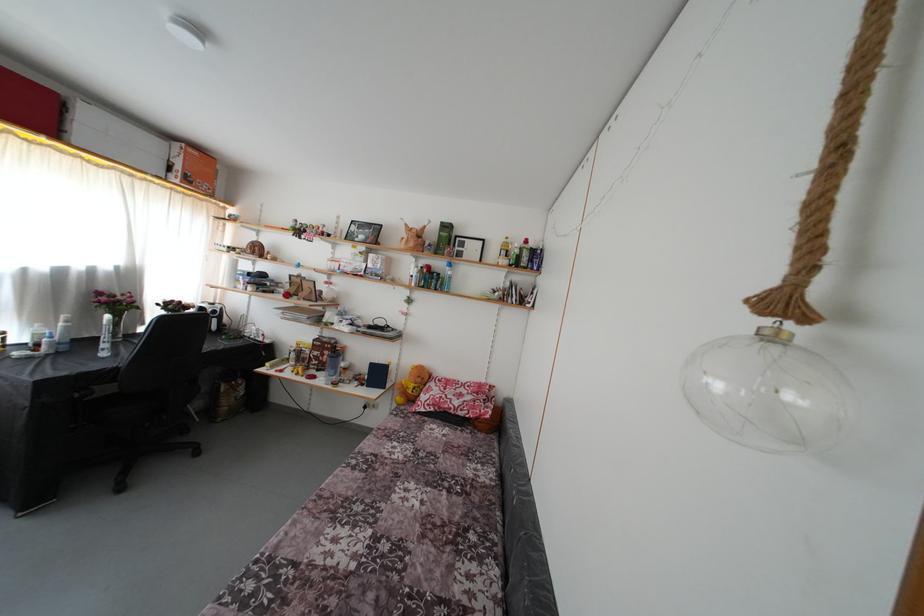
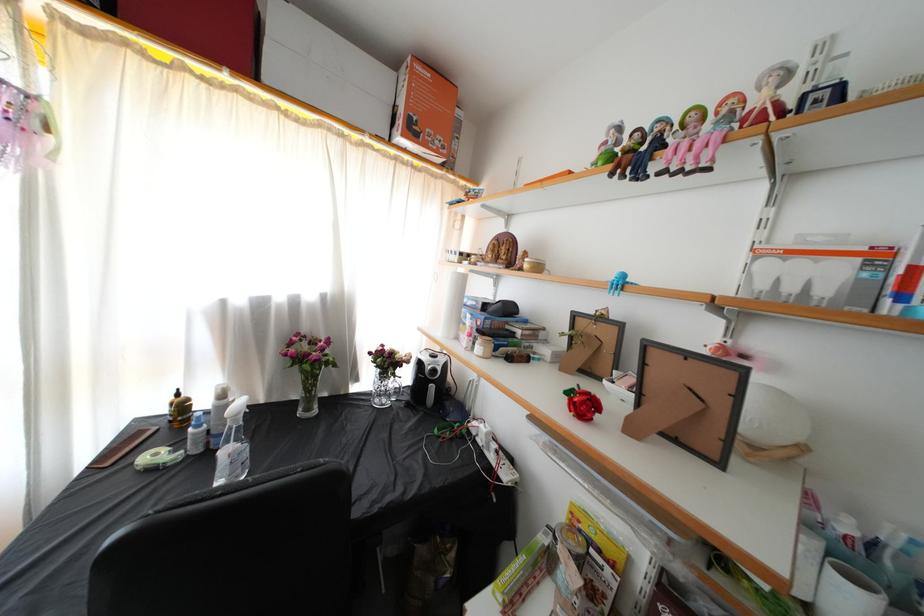
Locate, in the second image, the point that corresponds to [224,312] in the first image.

(446, 365)